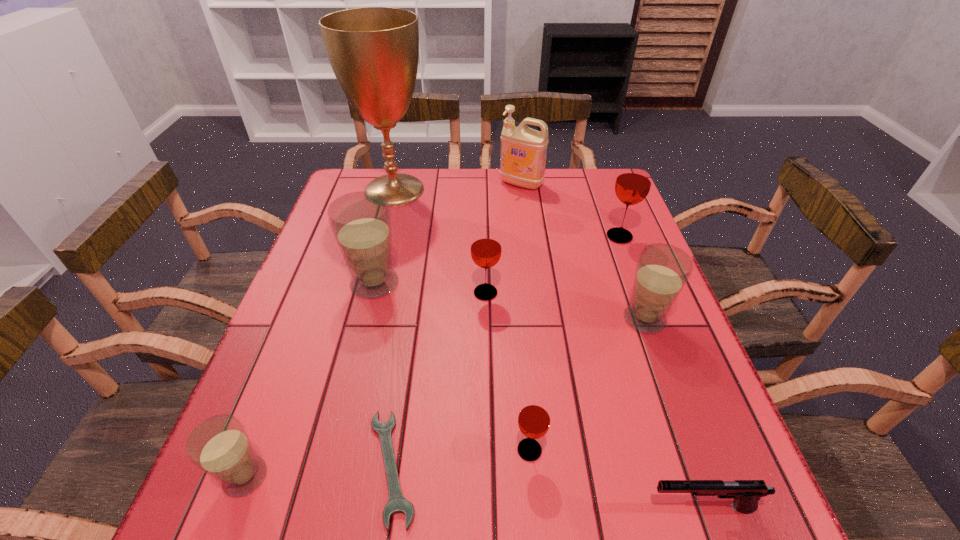
The height and width of the screenshot is (540, 960). I want to click on glass located at the near edge, so click(x=219, y=446).

Find the location of `gun that is at the near edge`. gun that is at the near edge is located at coordinates (746, 493).

What are the coordinates of `wrench present at the near edge` in the screenshot? It's located at (397, 503).

You are a GUI agent. You are given a task and a screenshot of the screen. Output one action in this format:
    pyautogui.click(x=<x>, y=<y>)
    Task: Click on the trophy cup that is positioned at the left edge
    The height and width of the screenshot is (540, 960).
    Given the screenshot: What is the action you would take?
    pyautogui.click(x=374, y=51)

Locate an element on the screen. gun that is at the right edge is located at coordinates (746, 493).

At what (x,y) coordinates should I click in order to perform the action: click on object located in the far left corner section of the desktop. Please return your answer as a coordinate pair (x, y). The width and height of the screenshot is (960, 540). Looking at the image, I should click on (374, 51).

What are the coordinates of `object that is at the near left corner` in the screenshot? It's located at (219, 446).

Where is `object present at the near right corner`? object present at the near right corner is located at coordinates coord(746,493).

In the image, there is a desktop. Identify the location of free space at the far edge. (516, 207).

This screenshot has height=540, width=960. In order to click on vacant space at the near edge of the desktop in this screenshot , I will do `click(441, 518)`.